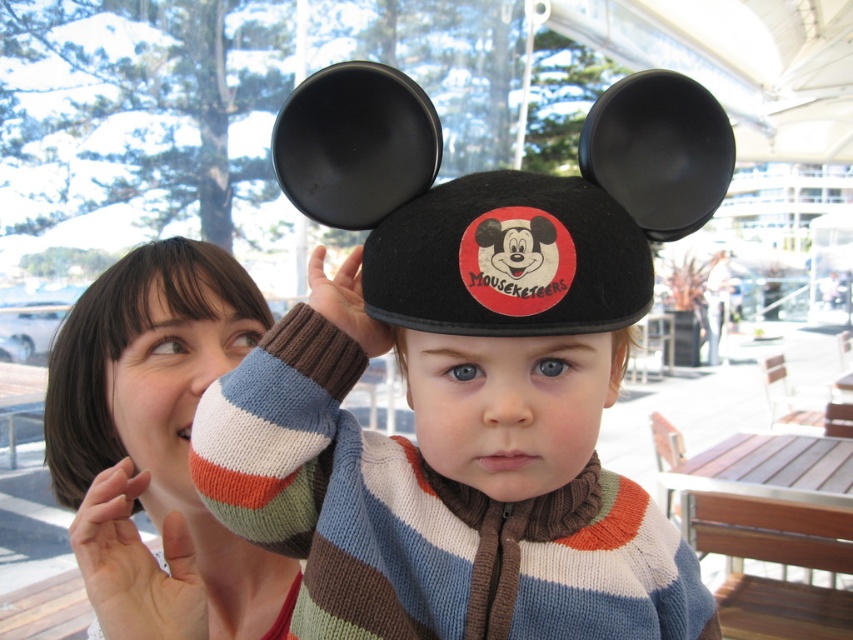
Question: Can you confirm if fuzzy woolen hat at center is thinner than knit sweater at center?

Choices:
 (A) no
 (B) yes

Answer: (A)

Question: Observing the image, what is the correct spatial positioning of knit sweater at center in reference to black felt ear at center?

Choices:
 (A) left
 (B) right

Answer: (A)

Question: Which of the following is the farthest from the observer?

Choices:
 (A) fuzzy woolen hat at center
 (B) black felt ear at center
 (C) knit sweater at center
 (D) black felt hat at center

Answer: (B)

Question: Among these objects, which one is farthest from the camera?

Choices:
 (A) knit sweater at center
 (B) black felt ear at center

Answer: (B)

Question: Which point is closer to the camera taking this photo?

Choices:
 (A) (399, 362)
 (B) (590, 496)
 (C) (683, 156)
 (D) (125, 564)

Answer: (D)

Question: Can you confirm if black felt hat at center is positioned above knit sweater at center?

Choices:
 (A) yes
 (B) no

Answer: (A)